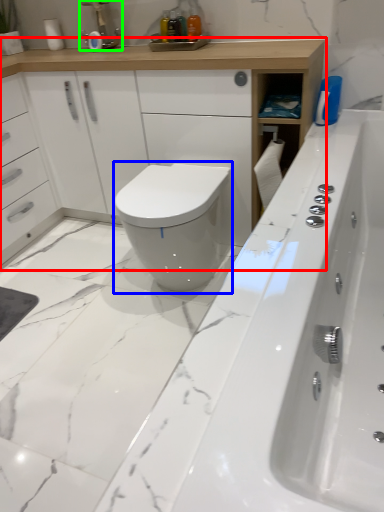
Question: Which is farther away from bathroom cabinet (highlighted by a red box)? bidet (highlighted by a blue box) or faucet (highlighted by a green box)?

Choices:
 (A) bidet
 (B) faucet

Answer: (A)